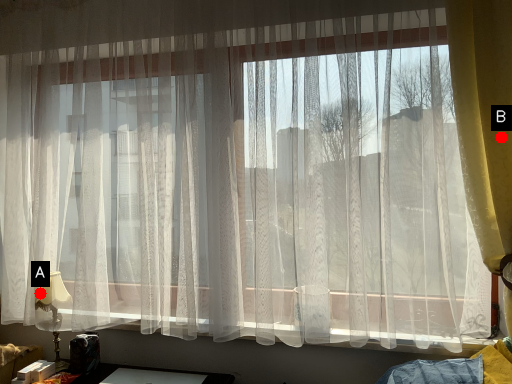
Question: Two points are circled on the image, labeled by A and B beside each circle. Among these points, which one is farthest from the camera?

Choices:
 (A) A is further
 (B) B is further

Answer: (A)